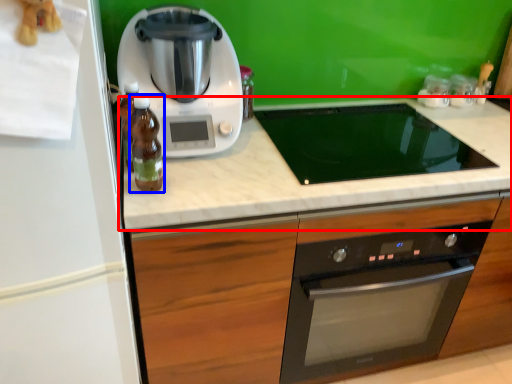
Question: Which of the following is the farthest to the observer, countertop (highlighted by a red box) or bottle (highlighted by a blue box)?

Choices:
 (A) countertop
 (B) bottle

Answer: (A)